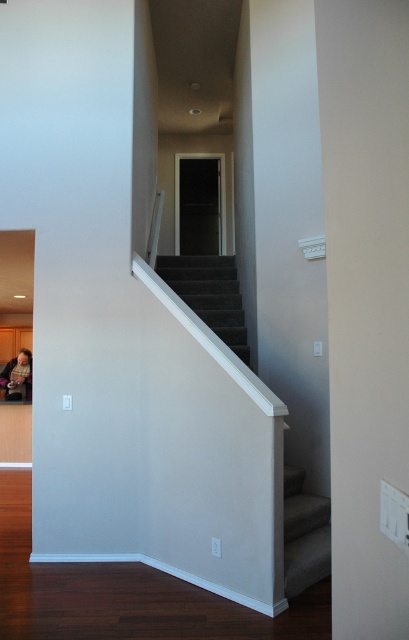
Question: Is dark gray carpeted stairs at center to the right of suede-like gray stair at lower right from the viewer's perspective?

Choices:
 (A) yes
 (B) no

Answer: (B)

Question: Can you confirm if carpeted stairs at center is positioned above suede-like gray stair at lower right?

Choices:
 (A) no
 (B) yes

Answer: (B)

Question: Which object is closer to the camera taking this photo?

Choices:
 (A) carpeted stairs at center
 (B) suede-like gray stair at lower right
 (C) dark gray carpeted stairs at center

Answer: (B)

Question: Can you confirm if carpeted stairs at center is positioned to the left of dark gray carpeted stairs at center?

Choices:
 (A) no
 (B) yes

Answer: (B)

Question: Which of the following is the farthest from the observer?

Choices:
 (A) (305, 584)
 (B) (307, 504)
 (C) (164, 268)

Answer: (C)

Question: Estimate the real-world distances between objects in this image. Which object is closer to the carpeted stairs at center?

Choices:
 (A) dark gray carpeted stairs at center
 (B) suede-like gray stair at lower right

Answer: (A)